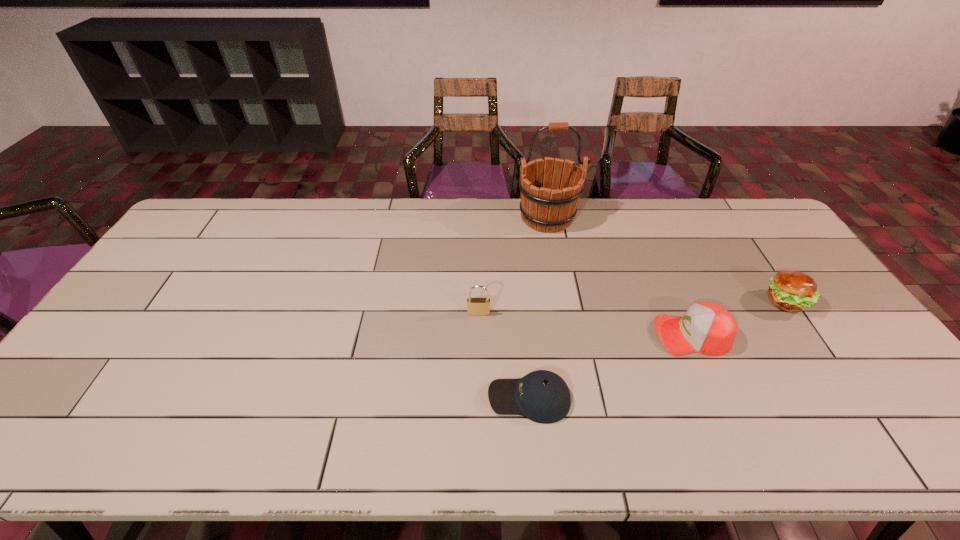
Where is `wine bucket`? wine bucket is located at coordinates [x=545, y=207].

This screenshot has height=540, width=960. What are the coordinates of `the farthest object` in the screenshot? It's located at (545, 207).

Where is `padlock`? Image resolution: width=960 pixels, height=540 pixels. padlock is located at coordinates (475, 306).

I want to click on the rightmost object, so click(791, 291).

This screenshot has width=960, height=540. What are the coordinates of `the right baseball cap` in the screenshot? It's located at (707, 328).

I want to click on the fourth object from left to right, so click(x=707, y=328).

In order to click on the shorter baseball cap in this screenshot , I will do `click(542, 396)`.

Identify the location of the shortest object. The image size is (960, 540). (542, 396).

Identify the location of free space located 0.340m on the right of the wine bucket. Image resolution: width=960 pixels, height=540 pixels. click(x=675, y=218).

The image size is (960, 540). Find the location of `free point located 0.090m on the front-facing side of the padlock`. free point located 0.090m on the front-facing side of the padlock is located at coordinates (479, 341).